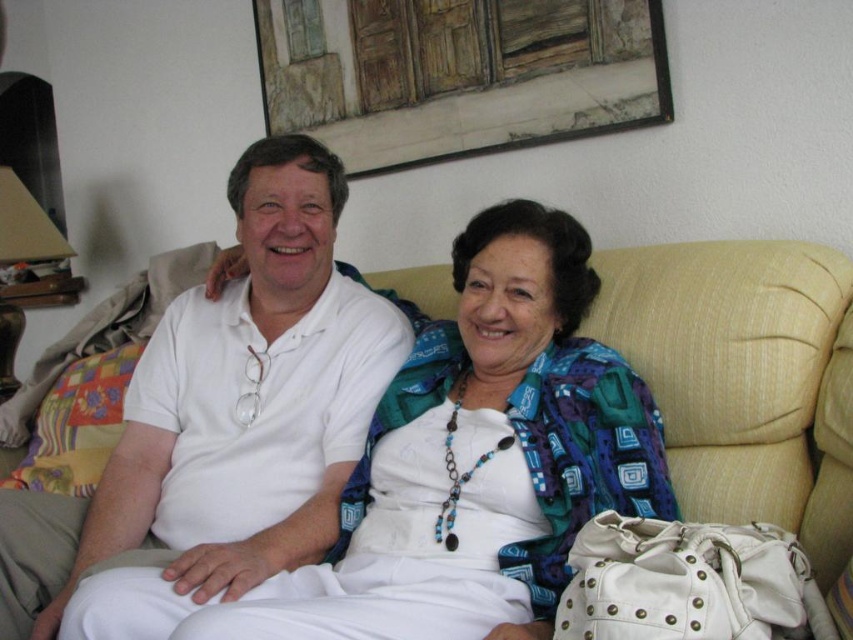
Question: Which point is farther to the camera?

Choices:
 (A) white matte shirt at center
 (B) beige fabric couch at center

Answer: (B)

Question: Considering the relative positions of white matte shirt at center and beige fabric couch at center in the image provided, where is white matte shirt at center located with respect to beige fabric couch at center?

Choices:
 (A) below
 (B) above

Answer: (A)

Question: Is white matte shirt at center to the left of beige fabric couch at center from the viewer's perspective?

Choices:
 (A) yes
 (B) no

Answer: (A)

Question: Is white matte shirt at center wider than beige fabric couch at center?

Choices:
 (A) no
 (B) yes

Answer: (B)